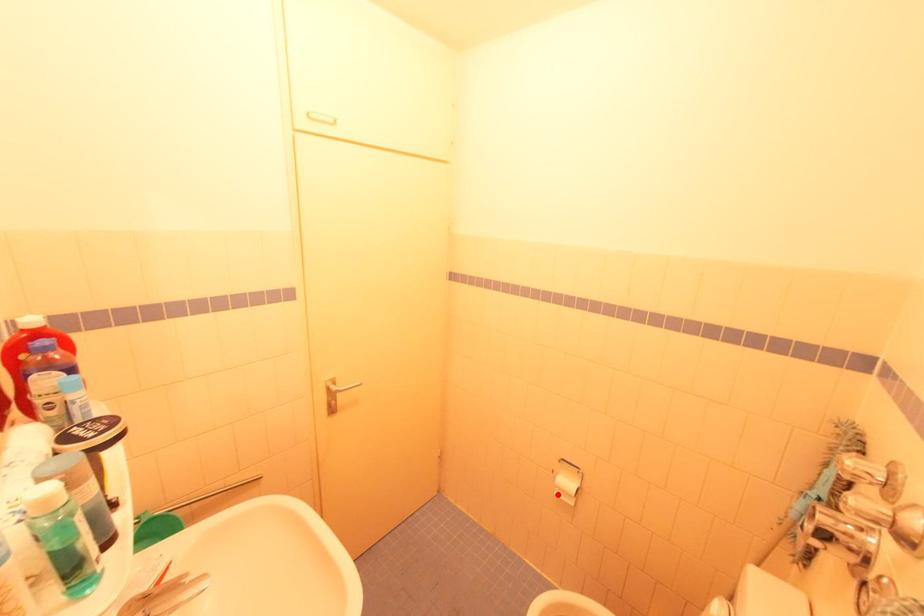
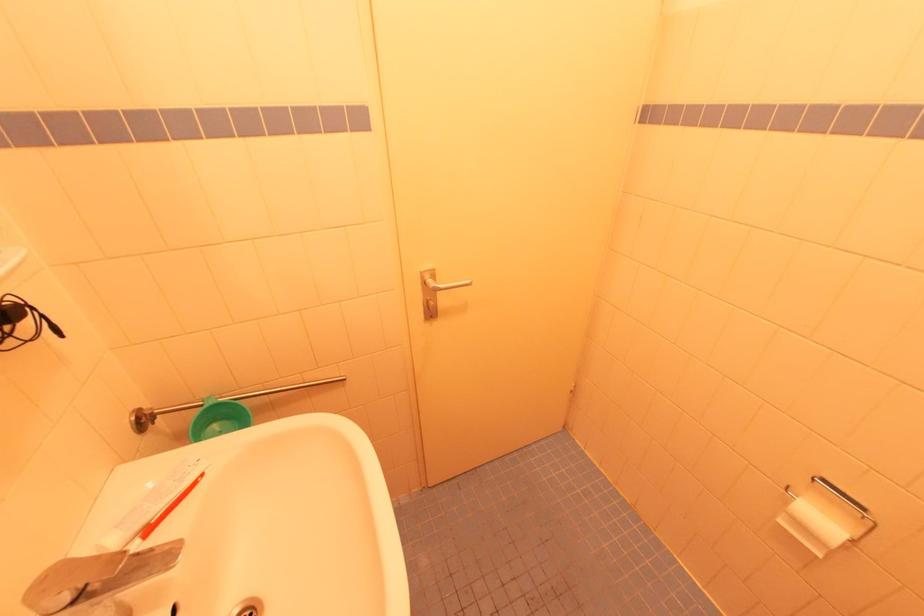
Question: I am providing you with two images of the same scene from different viewpoints. Given a red point in image1, look at the same physical point in image2. Is it:

Choices:
 (A) Closer to the viewpoint
 (B) Farther from the viewpoint

Answer: (A)